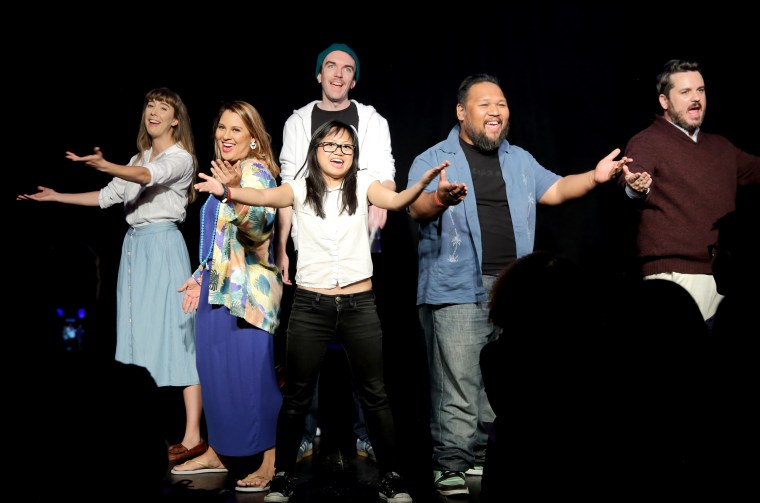
This screenshot has height=503, width=760. What are the coordinates of `stage` in the screenshot? It's located at (242, 321).